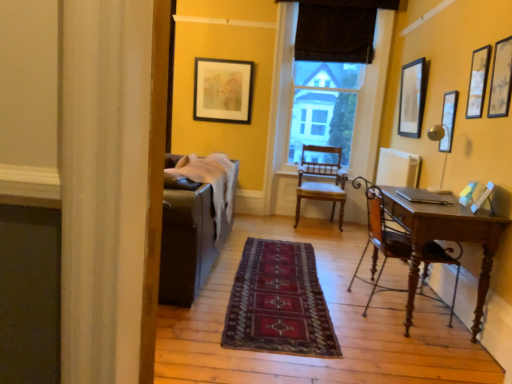
Question: Does dark red woven rug at center touch wooden chair at right, marked as the 2th chair in a back-to-front arrangement?

Choices:
 (A) yes
 (B) no

Answer: (B)

Question: Is the position of dark red woven rug at center more distant than that of wooden chair at right, the 1th chair when ordered from front to back?

Choices:
 (A) yes
 (B) no

Answer: (B)

Question: Is dark red woven rug at center wider than wooden chair at right, marked as the 2th chair in a back-to-front arrangement?

Choices:
 (A) yes
 (B) no

Answer: (A)

Question: Is dark red woven rug at center smaller than wooden chair at right, the 1th chair when ordered from front to back?

Choices:
 (A) yes
 (B) no

Answer: (A)

Question: From a real-world perspective, is dark red woven rug at center located beneath wooden chair at right, the 1th chair when ordered from front to back?

Choices:
 (A) no
 (B) yes

Answer: (B)

Question: Can we say dark red woven rug at center lies outside wooden chair at right, marked as the 2th chair in a back-to-front arrangement?

Choices:
 (A) no
 (B) yes

Answer: (B)

Question: Is metallic silver picture frame at upper right, placed as the third picture frame when sorted from front to back, to the right of dark brown fabric at upper center from the viewer's perspective?

Choices:
 (A) yes
 (B) no

Answer: (A)

Question: From the image's perspective, is metallic silver picture frame at upper right, placed as the third picture frame when sorted from front to back, beneath dark brown fabric at upper center?

Choices:
 (A) no
 (B) yes

Answer: (B)

Question: Is dark brown fabric at upper center at the back of metallic silver picture frame at upper right, placed as the third picture frame when sorted from front to back?

Choices:
 (A) yes
 (B) no

Answer: (B)

Question: Is metallic silver picture frame at upper right, placed as the third picture frame when sorted from front to back, outside dark brown fabric at upper center?

Choices:
 (A) yes
 (B) no

Answer: (A)

Question: Is metallic silver picture frame at upper right, placed as the third picture frame when sorted from front to back, bigger than dark brown fabric at upper center?

Choices:
 (A) yes
 (B) no

Answer: (B)

Question: From a real-world perspective, does metallic silver picture frame at upper right, which ranks as the fourth picture frame in left-to-right order, sit lower than dark brown fabric at upper center?

Choices:
 (A) no
 (B) yes

Answer: (B)

Question: Is matte wooden picture frame at upper right, which is the fourth picture frame from right to left, to the left of wooden chair at right, marked as the 2th chair in a back-to-front arrangement, from the viewer's perspective?

Choices:
 (A) yes
 (B) no

Answer: (B)